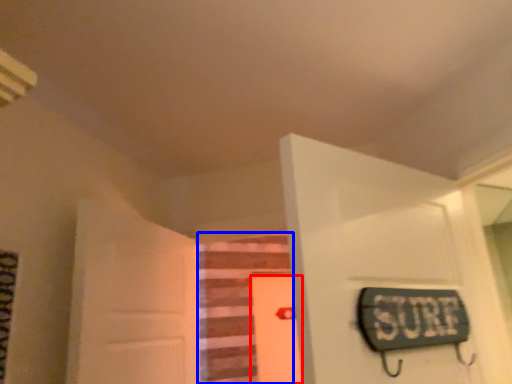
Question: Among these objects, which one is farthest to the camera, door (highlighted by a red box) or stairwell (highlighted by a blue box)?

Choices:
 (A) door
 (B) stairwell

Answer: (A)